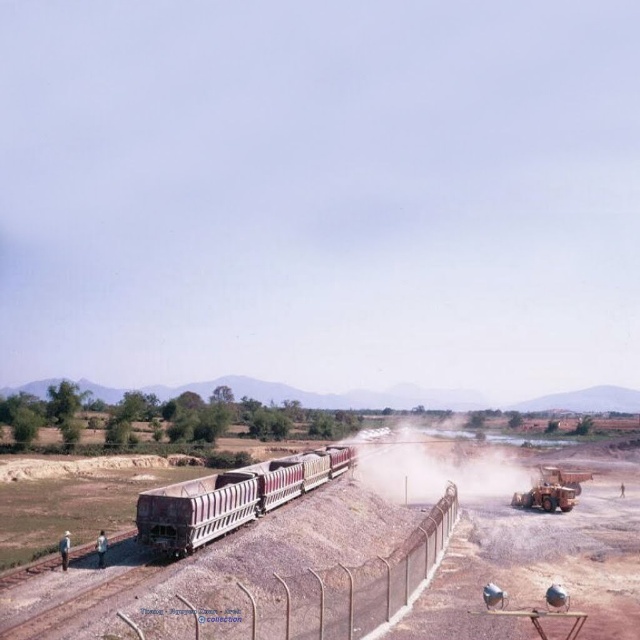
Does metallic wire fence at lower center have a smaller size compared to dusty yellow steam at center?

Indeed, metallic wire fence at lower center has a smaller size compared to dusty yellow steam at center.

Can you confirm if metallic wire fence at lower center is taller than dusty yellow steam at center?

Incorrect, metallic wire fence at lower center's height is not larger of dusty yellow steam at center's.

At what (x,y) coordinates should I click in order to perform the action: click on metallic wire fence at lower center. Please return your answer as a coordinate pair (x, y). Looking at the image, I should click on (316, 593).

Between rusty metal train carriages at center and dusty yellow steam at center, which one appears on the left side from the viewer's perspective?

rusty metal train carriages at center is more to the left.

Which is above, rusty metal train carriages at center or dusty yellow steam at center?

rusty metal train carriages at center is higher up.

Locate an element on the screen. The image size is (640, 640). rusty metal train carriages at center is located at coordinates (230, 499).

You are a GUI agent. You are given a task and a screenshot of the screen. Output one action in this format:
    pyautogui.click(x=<x>, y=<y>)
    Task: Click on the rusty metal train carriages at center
    The height and width of the screenshot is (640, 640).
    Given the screenshot: What is the action you would take?
    pyautogui.click(x=230, y=499)

Can you confirm if metallic wire fence at lower center is shorter than rusty metal train carriages at center?

In fact, metallic wire fence at lower center may be taller than rusty metal train carriages at center.

Between metallic wire fence at lower center and rusty metal train carriages at center, which one is positioned higher?

metallic wire fence at lower center is above.

This screenshot has height=640, width=640. In order to click on metallic wire fence at lower center in this screenshot , I will do `click(316, 593)`.

Locate an element on the screen. This screenshot has width=640, height=640. metallic wire fence at lower center is located at coordinates point(316,593).